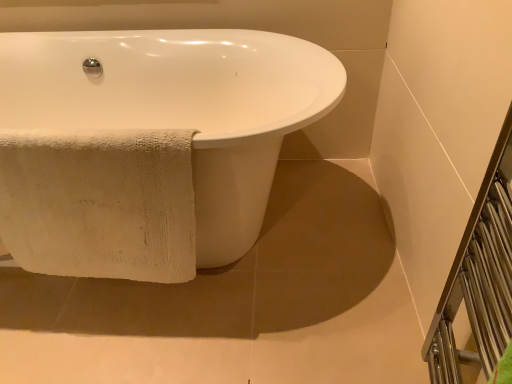
Question: Is white glossy bathtub at center further to camera compared to beige cotton towel at lower left?

Choices:
 (A) no
 (B) yes

Answer: (A)

Question: Is beige cotton towel at lower left surrounded by white glossy bathtub at center?

Choices:
 (A) no
 (B) yes

Answer: (B)

Question: Is white glossy bathtub at center oriented away from beige cotton towel at lower left?

Choices:
 (A) no
 (B) yes

Answer: (B)

Question: Is white glossy bathtub at center positioned beyond the bounds of beige cotton towel at lower left?

Choices:
 (A) yes
 (B) no

Answer: (A)

Question: Can you confirm if white glossy bathtub at center is positioned to the left of beige cotton towel at lower left?

Choices:
 (A) yes
 (B) no

Answer: (A)

Question: Is white towel at lower left inside or outside of metallic silver balustrade at right?

Choices:
 (A) inside
 (B) outside

Answer: (B)

Question: Based on their sizes in the image, would you say white towel at lower left is bigger or smaller than metallic silver balustrade at right?

Choices:
 (A) small
 (B) big

Answer: (B)

Question: In the image, is white towel at lower left on the left side or the right side of metallic silver balustrade at right?

Choices:
 (A) left
 (B) right

Answer: (A)

Question: From the image's perspective, is white towel at lower left positioned above or below metallic silver balustrade at right?

Choices:
 (A) above
 (B) below

Answer: (A)

Question: Is white towel at lower left bigger or smaller than white glossy bathtub at center?

Choices:
 (A) small
 (B) big

Answer: (A)

Question: Considering the positions of white towel at lower left and white glossy bathtub at center in the image, is white towel at lower left wider or thinner than white glossy bathtub at center?

Choices:
 (A) thin
 (B) wide

Answer: (B)

Question: From a real-world perspective, is white towel at lower left physically located above or below white glossy bathtub at center?

Choices:
 (A) above
 (B) below

Answer: (B)

Question: Does point (385, 362) appear closer or farther from the camera than point (268, 173)?

Choices:
 (A) closer
 (B) farther

Answer: (A)

Question: Is beige cotton towel at lower left in front of or behind white towel at lower left in the image?

Choices:
 (A) front
 (B) behind

Answer: (A)

Question: In the image, is beige cotton towel at lower left on the left side or the right side of white towel at lower left?

Choices:
 (A) left
 (B) right

Answer: (A)